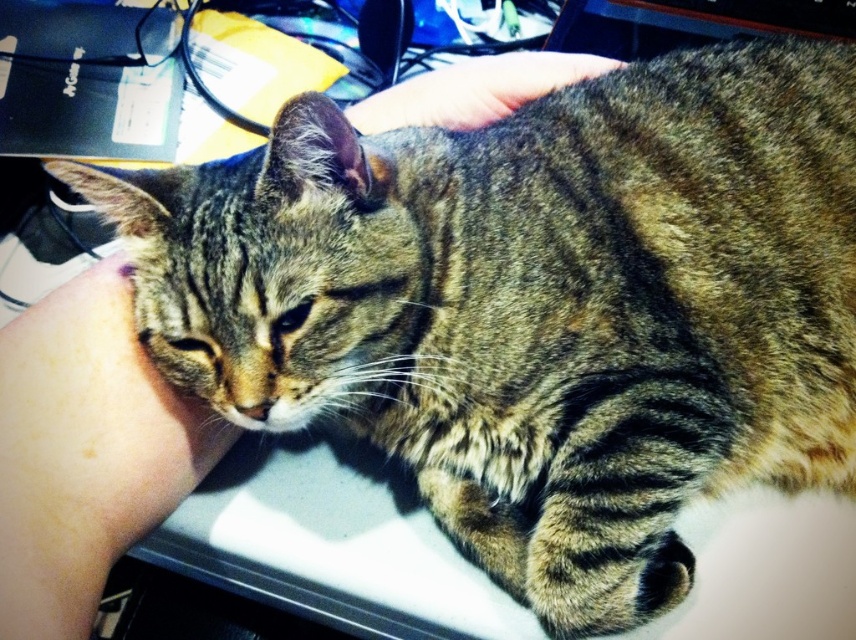
Is point (80, 358) positioned before point (366, 122)?

Yes, point (80, 358) is in front of point (366, 122).

Which is in front, point (129, 420) or point (599, 61)?

Point (129, 420) is more forward.

Locate an element on the screen. skinny white skin at lower left is located at coordinates (85, 451).